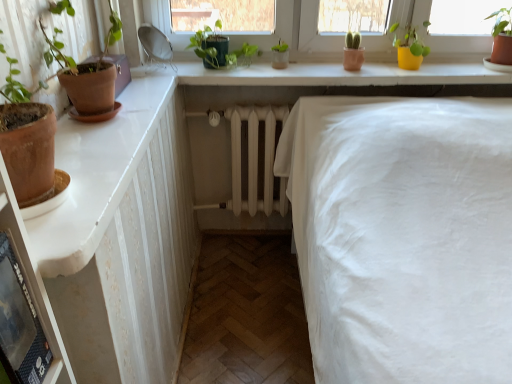
Locate an element on the screen. Image resolution: width=512 pixels, height=384 pixels. vacant space that is to the left of green matte flowerpot at center is located at coordinates (247, 68).